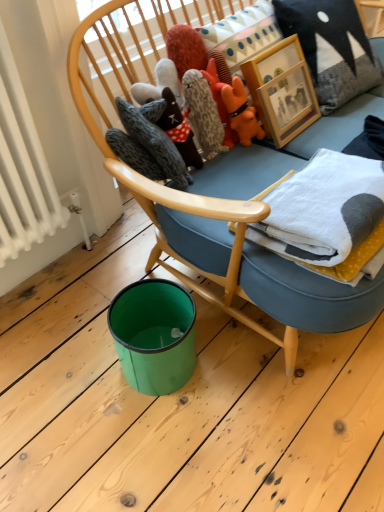
Question: In terms of height, does orange plush toy at upper center, which is the 1th toy from right to left, look taller or shorter compared to fluffy gray plush at upper center?

Choices:
 (A) short
 (B) tall

Answer: (A)

Question: Considering their positions, is orange plush toy at upper center, which is the 1th toy from right to left, located in front of or behind fluffy gray plush at upper center?

Choices:
 (A) front
 (B) behind

Answer: (B)

Question: Based on their relative distances, which object is farther from the fluffy gray plush at upper center?

Choices:
 (A) orange plush toy at upper center, which is counted as the second toy, starting from the left
 (B) wooden picture frame at upper center
 (C) textured gray pillow at upper right
 (D) fluffy gray stuffed animal at upper center, which appears as the second toy when viewed from the right
 (E) white fleece blanket at upper right

Answer: (C)

Question: Which of these objects is positioned closest to the white fleece blanket at upper right?

Choices:
 (A) fluffy gray stuffed animal at upper center, which appears as the second toy when viewed from the right
 (B) textured gray pillow at upper right
 (C) wooden picture frame at upper center
 (D) orange plush toy at upper center, which is the 1th toy from right to left
 (E) fluffy gray plush at upper center

Answer: (C)